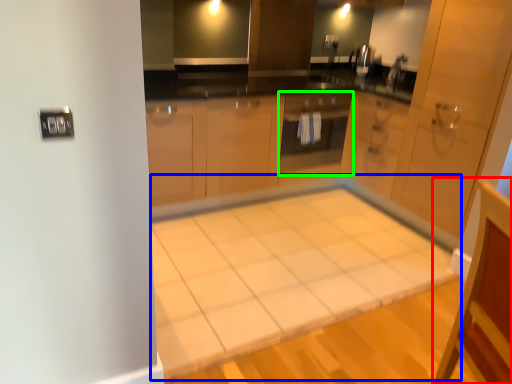
Question: Which object is positioned closest to vanity (highlighted by a red box)? Select from table (highlighted by a blue box) and oven (highlighted by a green box).

Choices:
 (A) table
 (B) oven

Answer: (A)